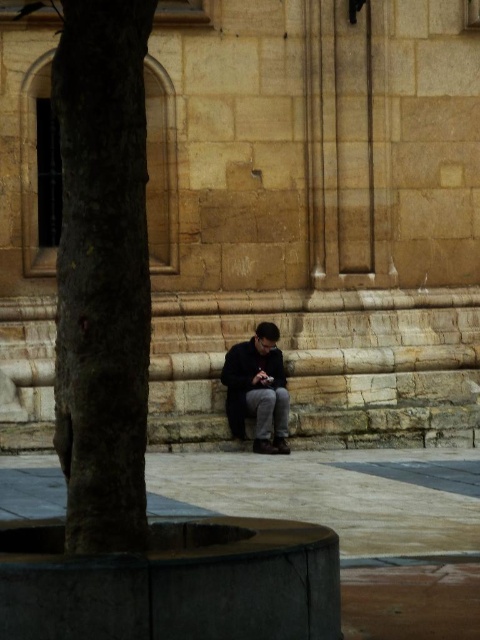
You are a city planner assessing the urban space. The smooth brown tree trunk at left and the dark gray fabric jacket at center are both in your view. Which object is higher in height?

The smooth brown tree trunk at left is much taller than the dark gray fabric jacket at center, so the tree trunk is higher in height.

You are a pedestrian walking along the street and see the smooth brown tree trunk at left and the dark gray fabric jacket at center. Which object is positioned further to the left in the scene?

The smooth brown tree trunk at left is positioned further to the left than the dark gray fabric jacket at center.